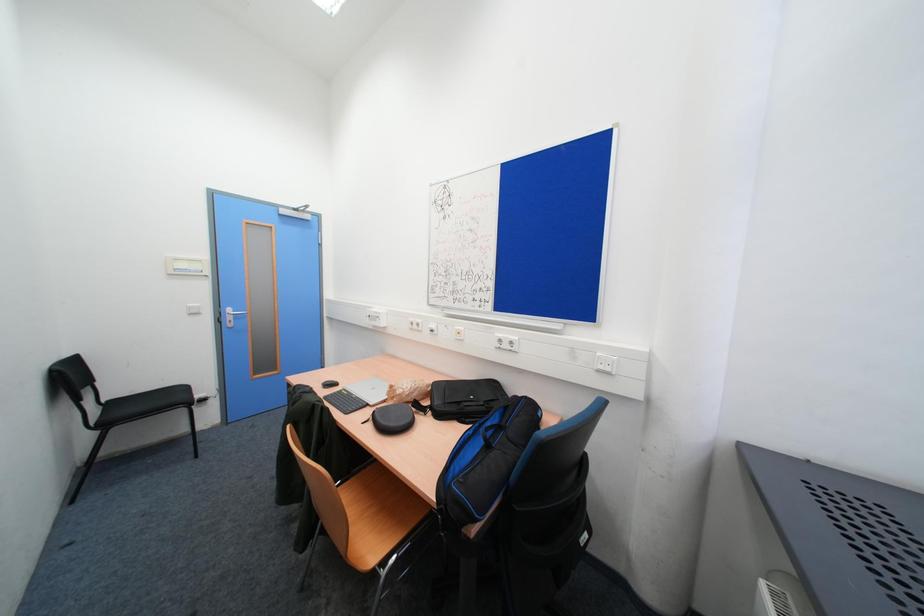
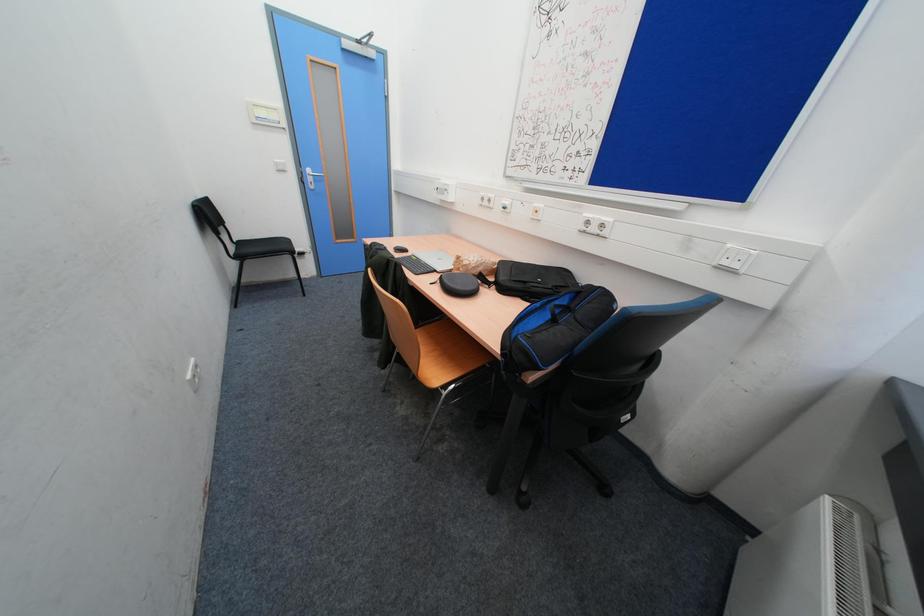
Question: Based on the continuous images, in which direction is the camera rotating? Reply with the corresponding letter.

Choices:
 (A) Left
 (B) Right
 (C) Up
 (D) Down

Answer: (D)